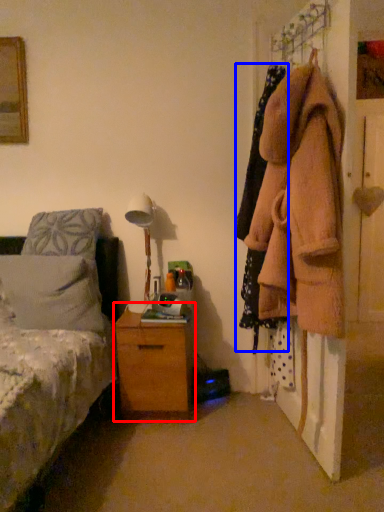
Question: Which object is closer to the camera taking this photo, chest of drawers (highlighted by a red box) or clothing (highlighted by a blue box)?

Choices:
 (A) chest of drawers
 (B) clothing

Answer: (B)